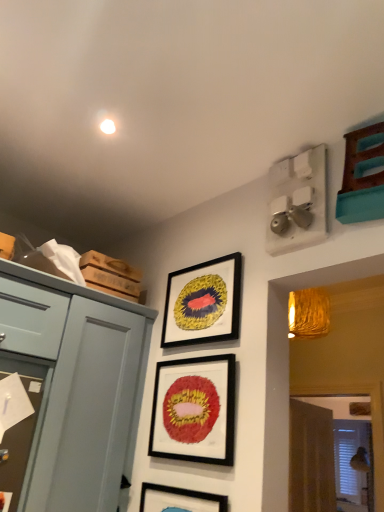
Question: Would you consider matte black picture frame at upper center, which appears as the 1th picture frame when viewed from the top, to be distant from matte blue cabinet at left?

Choices:
 (A) no
 (B) yes

Answer: (A)

Question: Is matte black picture frame at upper center, which appears as the 1th picture frame when viewed from the top, to the right of matte blue cabinet at left from the viewer's perspective?

Choices:
 (A) no
 (B) yes

Answer: (B)

Question: From a real-world perspective, is matte black picture frame at upper center, the third picture frame in the bottom-to-top sequence, physically below matte blue cabinet at left?

Choices:
 (A) yes
 (B) no

Answer: (B)

Question: Is matte black picture frame at upper center, the third picture frame in the bottom-to-top sequence, placed right next to matte blue cabinet at left?

Choices:
 (A) yes
 (B) no

Answer: (B)

Question: Does matte black picture frame at upper center, which appears as the 1th picture frame when viewed from the top, have a lesser height compared to matte blue cabinet at left?

Choices:
 (A) no
 (B) yes

Answer: (B)

Question: From the image's perspective, is matte black picture frame at center, placed as the 2th picture frame when sorted from bottom to top, located above or below brown textured curtain at lower right?

Choices:
 (A) above
 (B) below

Answer: (A)

Question: Is matte black picture frame at center, which is the 2th picture frame in top-to-bottom order, wider or thinner than brown textured curtain at lower right?

Choices:
 (A) wide
 (B) thin

Answer: (B)

Question: Would you say matte black picture frame at center, placed as the 2th picture frame when sorted from bottom to top, is inside or outside brown textured curtain at lower right?

Choices:
 (A) inside
 (B) outside

Answer: (B)

Question: Considering the positions of matte black picture frame at center, which is the 2th picture frame in top-to-bottom order, and brown textured curtain at lower right in the image, is matte black picture frame at center, which is the 2th picture frame in top-to-bottom order, taller or shorter than brown textured curtain at lower right?

Choices:
 (A) tall
 (B) short

Answer: (B)

Question: Considering the positions of point (137, 369) and point (188, 454), is point (137, 369) closer or farther from the camera than point (188, 454)?

Choices:
 (A) farther
 (B) closer

Answer: (A)

Question: From the image's perspective, relative to matte black picture frame at center, which is the 2th picture frame in top-to-bottom order, is matte blue cabinet at left above or below?

Choices:
 (A) below
 (B) above

Answer: (A)

Question: Would you say matte blue cabinet at left is to the left or to the right of matte black picture frame at center, placed as the 2th picture frame when sorted from bottom to top, in the picture?

Choices:
 (A) right
 (B) left

Answer: (B)

Question: Looking at their shapes, would you say matte blue cabinet at left is wider or thinner than matte black picture frame at center, which is the 2th picture frame in top-to-bottom order?

Choices:
 (A) wide
 (B) thin

Answer: (A)

Question: Does point (16, 317) appear closer or farther from the camera than point (135, 315)?

Choices:
 (A) closer
 (B) farther

Answer: (A)

Question: Is matte blue drawer at left wider or thinner than matte blue cabinet at left?

Choices:
 (A) thin
 (B) wide

Answer: (A)